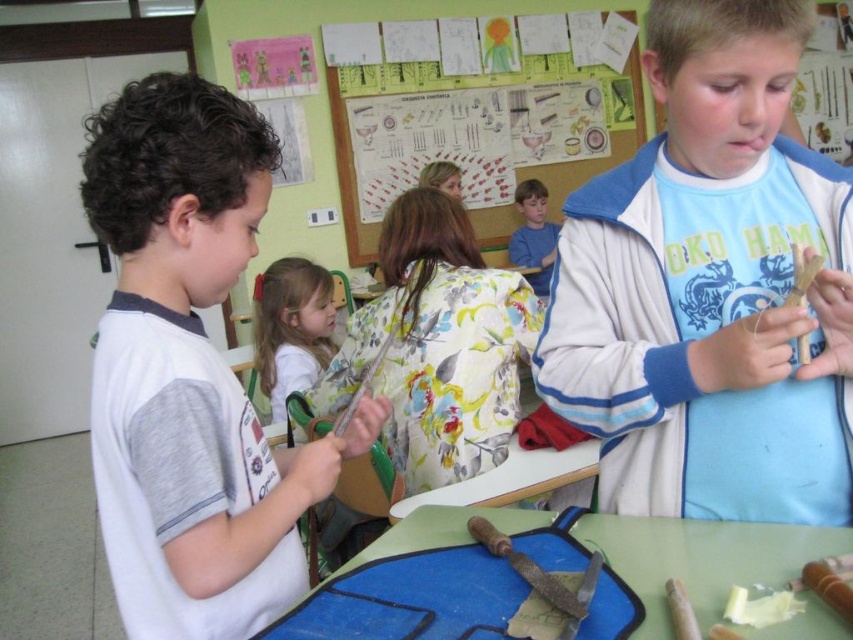
Question: Which point is closer to the camera taking this photo?

Choices:
 (A) (318, 355)
 (B) (527, 241)
 (C) (175, 349)
 (D) (755, 506)

Answer: (C)

Question: Which object appears closest to the camera in this image?

Choices:
 (A) white matte shirt at center
 (B) wooden stick at right
 (C) white matte shirt at left
 (D) blue fabric at lower center

Answer: (D)

Question: Which point is closer to the camera?

Choices:
 (A) (808, 192)
 (B) (534, 250)

Answer: (A)

Question: Is white matte shirt at left smaller than white matte shirt at center?

Choices:
 (A) no
 (B) yes

Answer: (B)

Question: Observing the image, what is the correct spatial positioning of wooden stick at right in reference to white matte shirt at left?

Choices:
 (A) left
 (B) right

Answer: (B)

Question: In this image, where is wooden stick at right located relative to white matte shirt at center?

Choices:
 (A) above
 (B) below

Answer: (A)